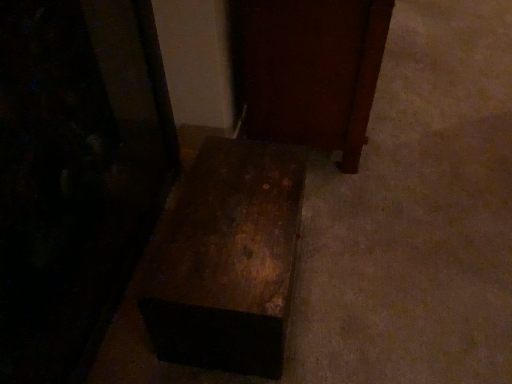
Question: Considering the relative sizes of rusty wood trunk at center, placed as the second furniture when sorted from left to right, and rusty metal box at lower center, the third furniture in the right-to-left sequence, in the image provided, is rusty wood trunk at center, placed as the second furniture when sorted from left to right, bigger than rusty metal box at lower center, the third furniture in the right-to-left sequence,?

Choices:
 (A) no
 (B) yes

Answer: (A)

Question: Considering the relative sizes of rusty wood trunk at center, placed as the second furniture when sorted from left to right, and rusty metal box at lower center, the 1th furniture from the left, in the image provided, is rusty wood trunk at center, placed as the second furniture when sorted from left to right, taller than rusty metal box at lower center, the 1th furniture from the left,?

Choices:
 (A) yes
 (B) no

Answer: (B)

Question: Is the position of rusty wood trunk at center, arranged as the second furniture when viewed from the right, less distant than that of rusty metal box at lower center, the 1th furniture from the left?

Choices:
 (A) no
 (B) yes

Answer: (A)

Question: Is rusty wood trunk at center, placed as the second furniture when sorted from left to right, thinner than rusty metal box at lower center, the third furniture in the right-to-left sequence?

Choices:
 (A) yes
 (B) no

Answer: (B)

Question: Can you see rusty wood trunk at center, placed as the second furniture when sorted from left to right, touching rusty metal box at lower center, the third furniture in the right-to-left sequence?

Choices:
 (A) yes
 (B) no

Answer: (B)

Question: Does rusty wood trunk at center, arranged as the second furniture when viewed from the right, have a smaller size compared to rusty metal box at lower center, the third furniture in the right-to-left sequence?

Choices:
 (A) no
 (B) yes

Answer: (B)

Question: Considering the relative sizes of dark wood door at center, marked as the 1th furniture in a right-to-left arrangement, and rusty wood trunk at center, placed as the second furniture when sorted from left to right, in the image provided, is dark wood door at center, marked as the 1th furniture in a right-to-left arrangement, thinner than rusty wood trunk at center, placed as the second furniture when sorted from left to right,?

Choices:
 (A) yes
 (B) no

Answer: (B)

Question: Can you confirm if dark wood door at center, which appears as the 3th furniture when viewed from the left, is wider than rusty wood trunk at center, placed as the second furniture when sorted from left to right?

Choices:
 (A) yes
 (B) no

Answer: (A)

Question: Can you confirm if dark wood door at center, which appears as the 3th furniture when viewed from the left, is bigger than rusty wood trunk at center, arranged as the second furniture when viewed from the right?

Choices:
 (A) yes
 (B) no

Answer: (A)

Question: Is dark wood door at center, which appears as the 3th furniture when viewed from the left, positioned behind rusty wood trunk at center, placed as the second furniture when sorted from left to right?

Choices:
 (A) yes
 (B) no

Answer: (A)

Question: Is dark wood door at center, marked as the 1th furniture in a right-to-left arrangement, taller than rusty wood trunk at center, placed as the second furniture when sorted from left to right?

Choices:
 (A) no
 (B) yes

Answer: (B)

Question: Does dark wood door at center, marked as the 1th furniture in a right-to-left arrangement, have a smaller size compared to rusty wood trunk at center, placed as the second furniture when sorted from left to right?

Choices:
 (A) no
 (B) yes

Answer: (A)

Question: Can you confirm if rusty metal box at lower center, the 1th furniture from the left, is thinner than dark wood door at center, marked as the 1th furniture in a right-to-left arrangement?

Choices:
 (A) no
 (B) yes

Answer: (B)